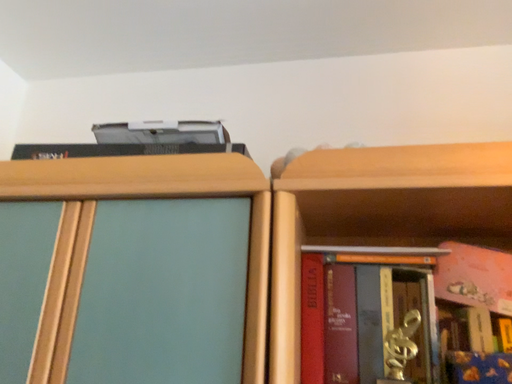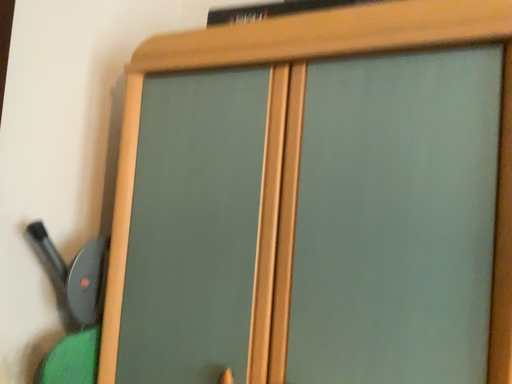
Question: Which way did the camera rotate in the video?

Choices:
 (A) rotated left
 (B) rotated right

Answer: (A)